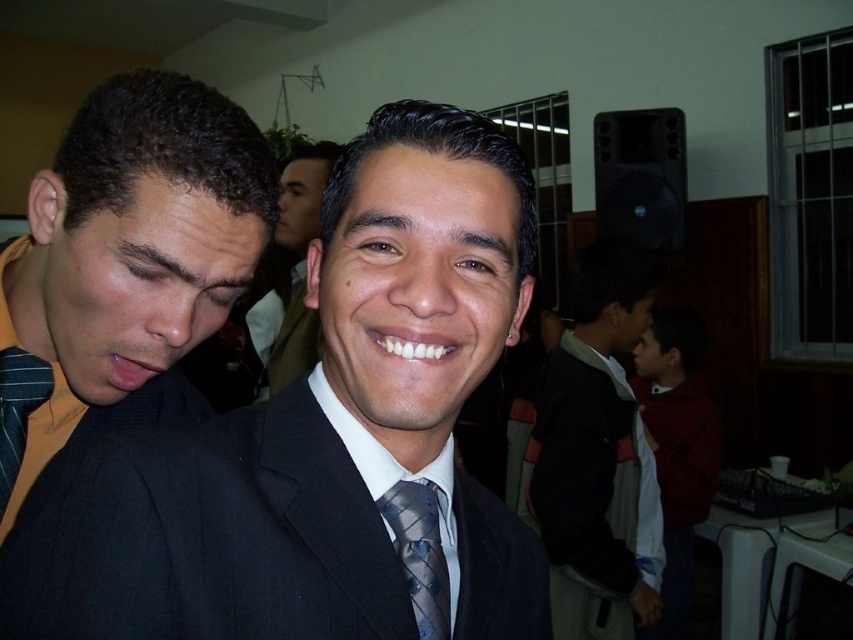
Question: Is matte black suit at left in front of blue textured tie at center?

Choices:
 (A) no
 (B) yes

Answer: (A)

Question: Which object is positioned farthest from the black suit at center?

Choices:
 (A) striped fabric tie at left
 (B) dark suit jacket at center
 (C) matte black suit at center
 (D) blue textured tie at center

Answer: (C)

Question: Which is farther from the striped fabric tie at left?

Choices:
 (A) black suit at center
 (B) matte black suit at left
 (C) dark suit jacket at center

Answer: (C)

Question: Estimate the real-world distances between objects in this image. Which object is closer to the black suit at center?

Choices:
 (A) blue textured tie at center
 (B) dark suit jacket at center
 (C) matte black suit at center
 (D) striped fabric tie at left

Answer: (A)

Question: Is black suit at center bigger than striped fabric tie at left?

Choices:
 (A) yes
 (B) no

Answer: (A)

Question: Can you confirm if dark suit jacket at center is positioned above striped fabric tie at left?

Choices:
 (A) yes
 (B) no

Answer: (B)